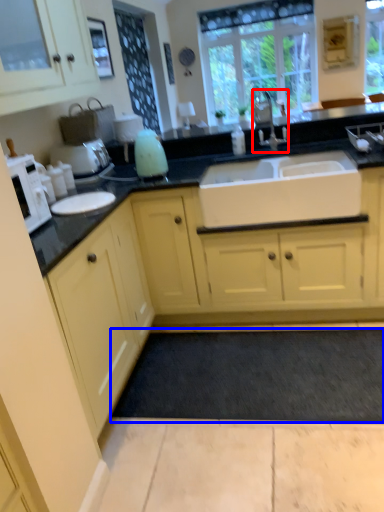
Question: Which point is closer to the camera, tap (highlighted by a red box) or plain (highlighted by a blue box)?

Choices:
 (A) tap
 (B) plain

Answer: (B)